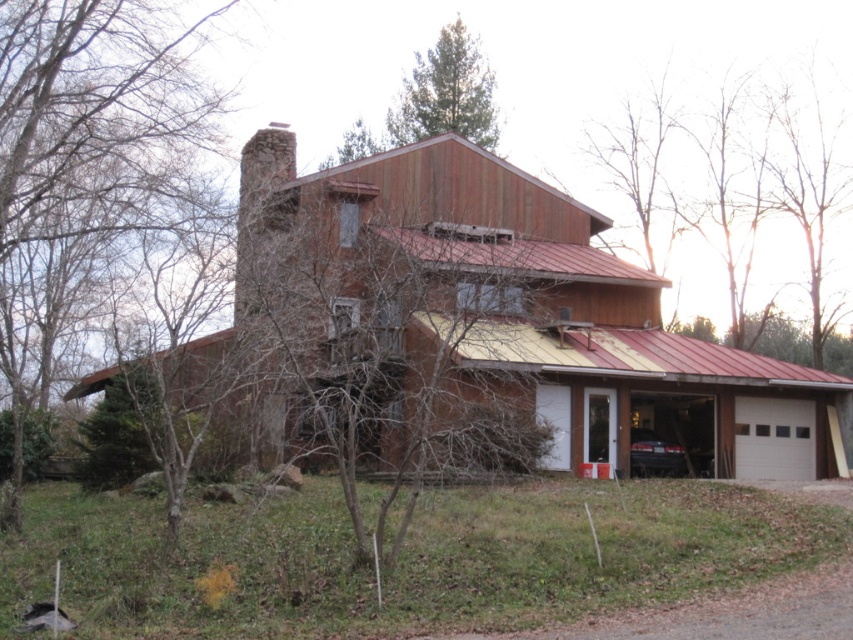
You are standing in front of the rustic house and notice two trees. The first is a green leafy tree at left, and the second is a green textured pine tree at upper center. Which tree is positioned higher up in the image?

The green textured pine tree at upper center is positioned higher up in the image than the green leafy tree at left.

You are standing in front of the rustic house and notice two trees. One is the green leafy tree at left and the other is the green textured pine tree at upper center. Which tree is located to the left of the other?

The green leafy tree at left is positioned on the left side of the green textured pine tree at upper center.